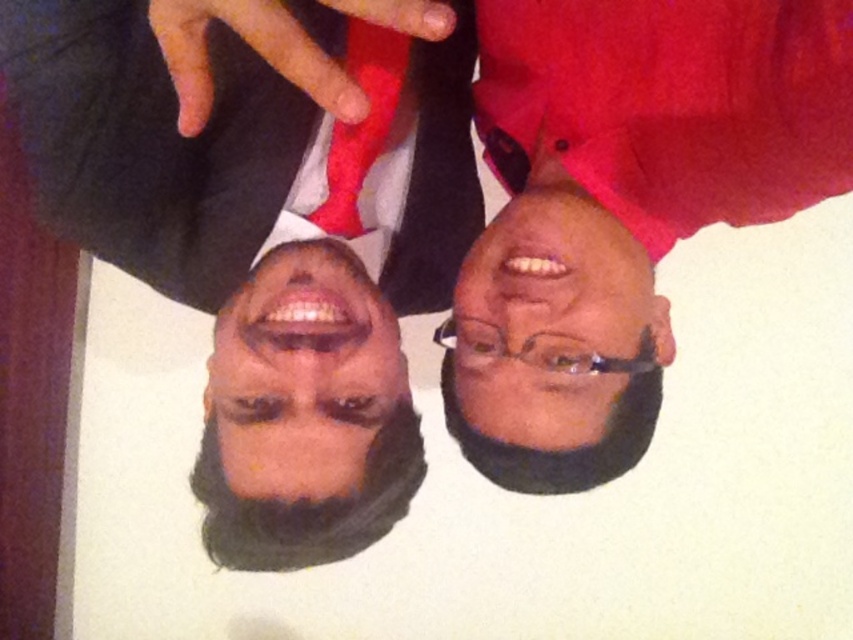
You are a photographer trying to adjust the lighting for a photo shoot. You notice the matte black glasses at center and the matte red fabric at upper center in the image. Which object is positioned lower in the frame?

The matte black glasses at center is located below the matte red fabric at upper center, so the matte black glasses at center is positioned lower in the frame.

You are an interior designer analyzing the image. You notice a point at coordinates (253, 49). What object is located at that point?

The point at coordinates (253, 49) corresponds to the matte red fabric at upper center.